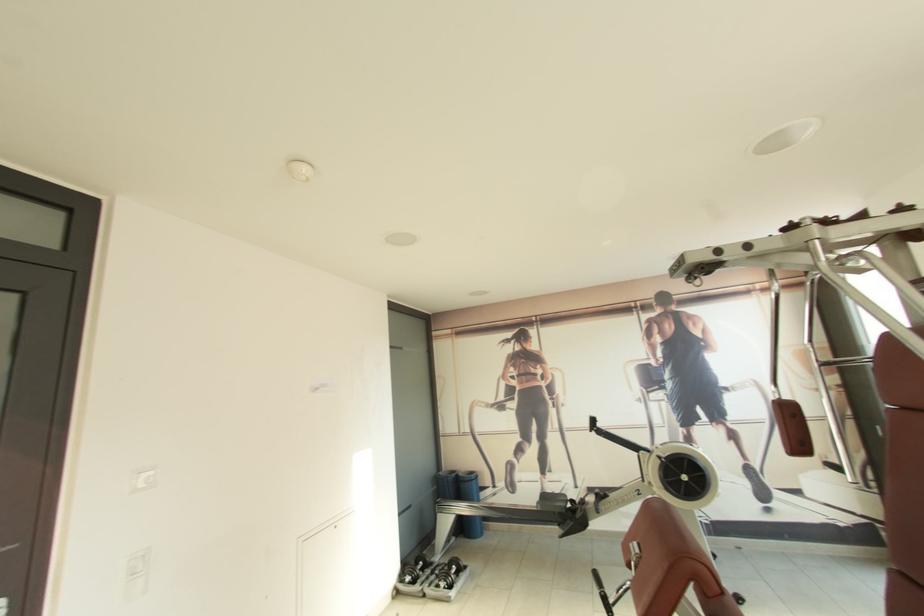
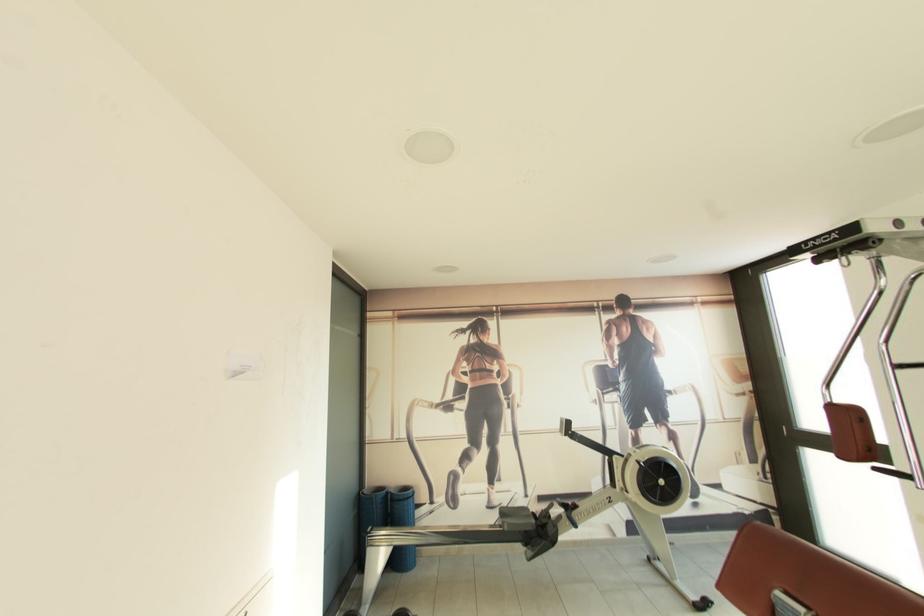
Find the pixel in the second image that matches point (476, 475) in the first image.

(410, 490)